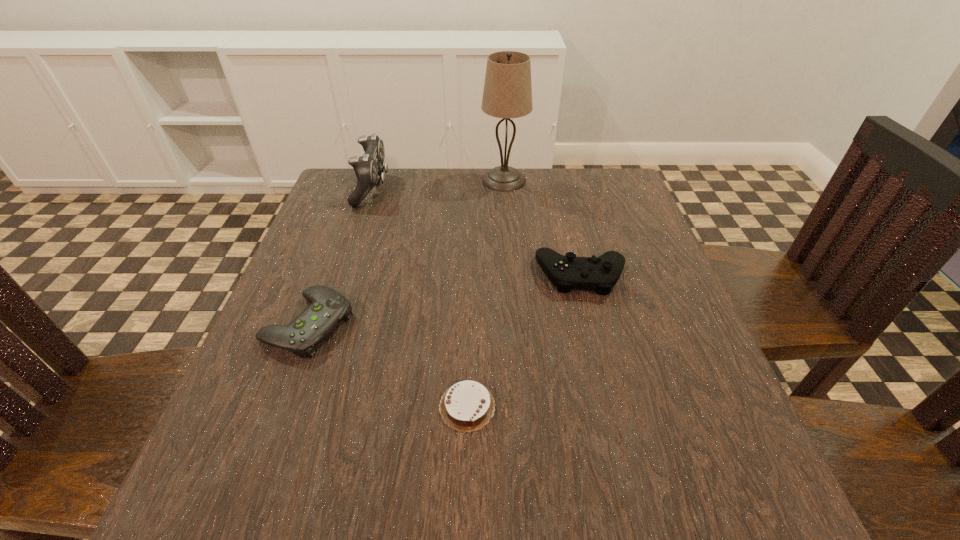
Locate an element on the screen. The image size is (960, 540). blank area located on the front-facing side of the tallest object is located at coordinates (451, 180).

In order to click on vacant space situated 0.230m on the surface of the fourth shortest object with buttons in this screenshot , I will do tap(477, 189).

Find the location of a particular element. The height and width of the screenshot is (540, 960). vacant region located on the front of the rightmost control is located at coordinates (613, 407).

The width and height of the screenshot is (960, 540). I want to click on free spot located on the right of the second shortest object, so [515, 324].

At what (x,y) coordinates should I click in order to perform the action: click on free space located 0.290m on the right of the nearest object. Please return your answer as a coordinate pair (x, y). The width and height of the screenshot is (960, 540). Looking at the image, I should click on (682, 406).

You are a GUI agent. You are given a task and a screenshot of the screen. Output one action in this format:
    pyautogui.click(x=<x>, y=<y>)
    Task: Click on the lampshade present at the far edge
    
    Given the screenshot: What is the action you would take?
    click(507, 93)

This screenshot has width=960, height=540. I want to click on control located at the far edge, so click(368, 168).

At what (x,y) coordinates should I click in order to perform the action: click on object at the right edge. Please return your answer as a coordinate pair (x, y). This screenshot has width=960, height=540. Looking at the image, I should click on (600, 274).

Image resolution: width=960 pixels, height=540 pixels. I want to click on object that is positioned at the far left corner, so click(368, 168).

Find the location of a particular element. The image size is (960, 540). free location at the far edge of the desktop is located at coordinates [472, 175].